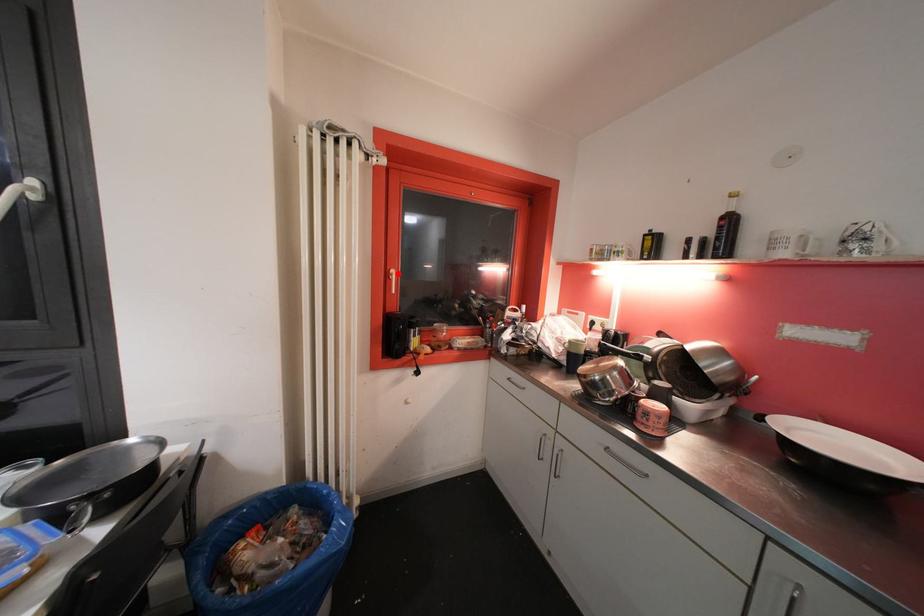
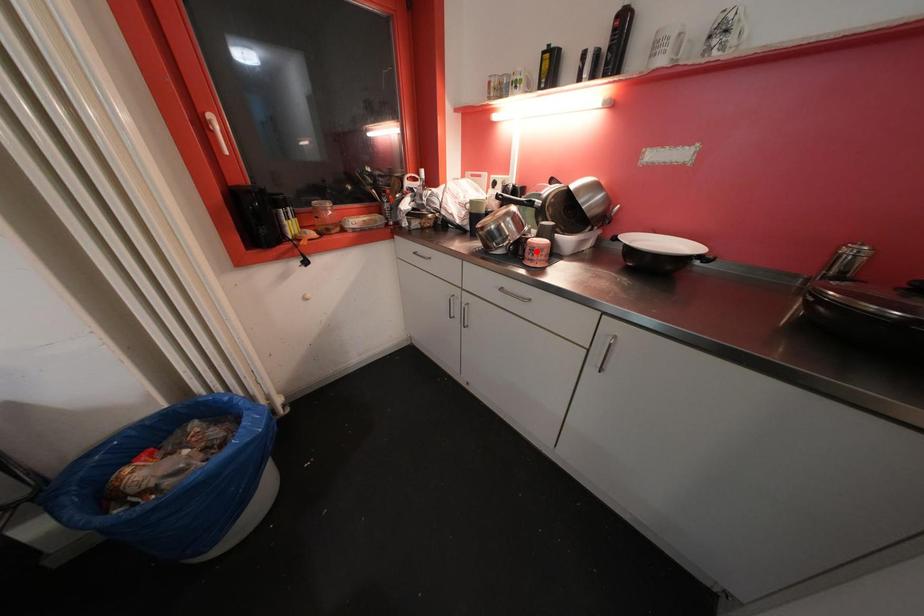
I am providing you with two images of the same scene from different viewpoints. A red point is marked on the first image and another point is marked on the second image. Does the point marked in image1 correspond to the same location as the one in image2?

No